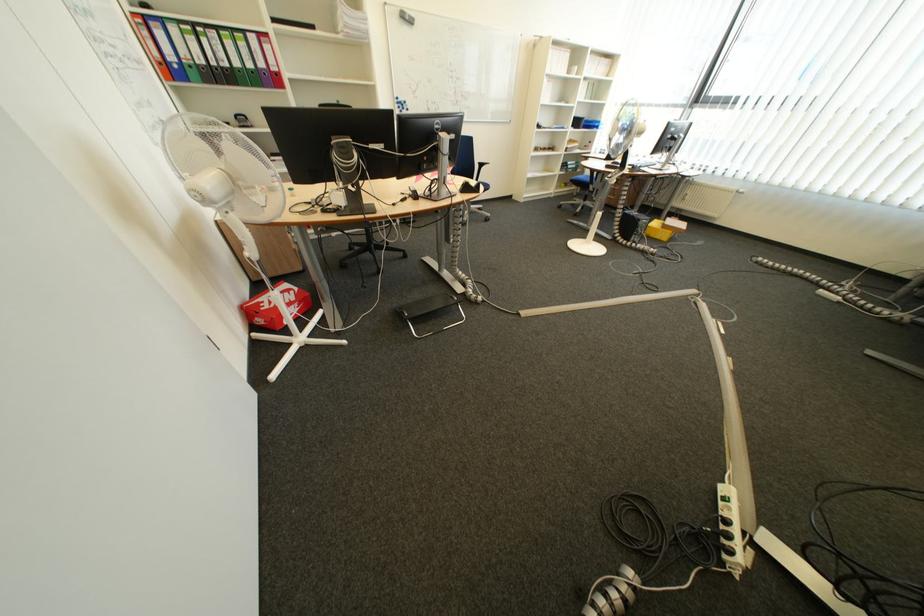
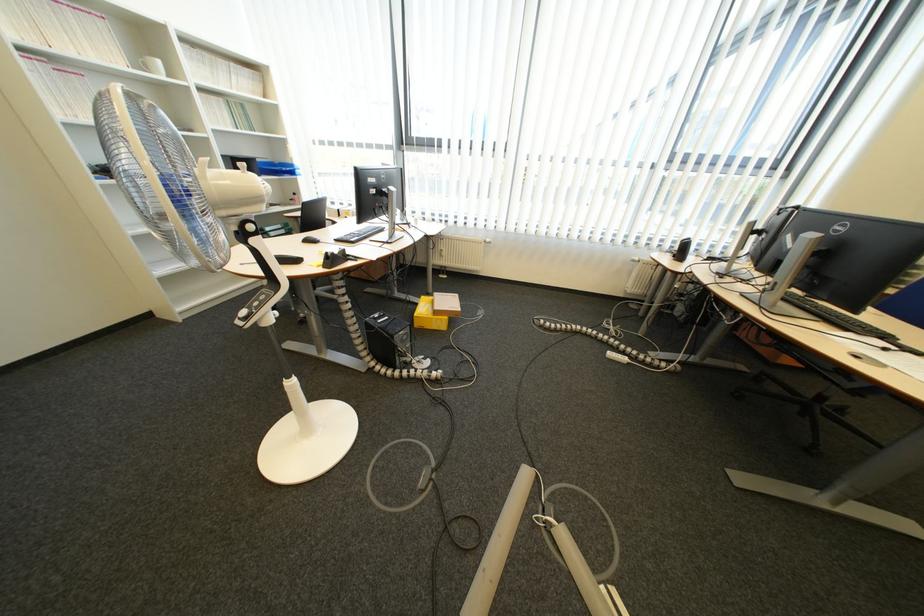
Where in the second image is the point corresponding to [602,121] from the first image?

(289, 163)